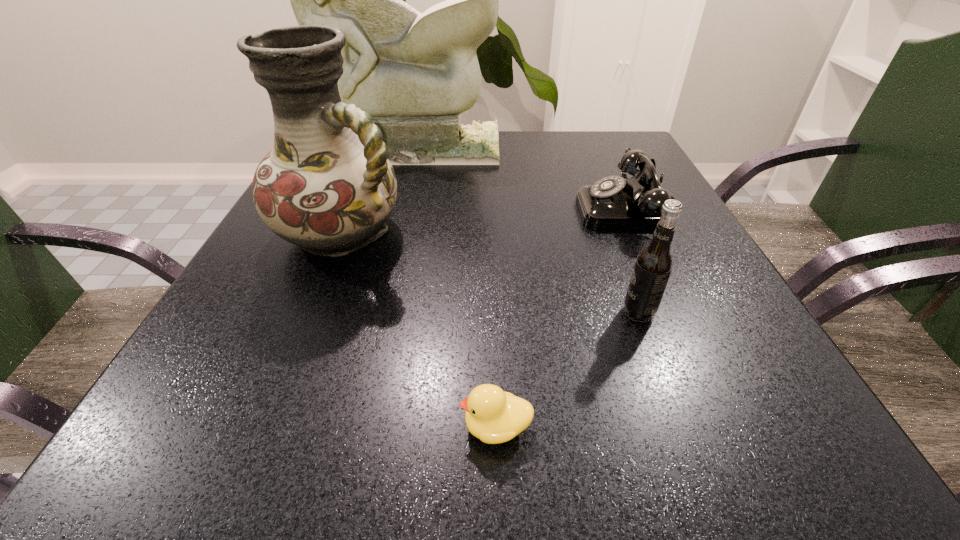
The height and width of the screenshot is (540, 960). In order to click on free space located on the label of the root beer in this screenshot , I will do `click(440, 312)`.

You are a GUI agent. You are given a task and a screenshot of the screen. Output one action in this format:
    pyautogui.click(x=<x>, y=<y>)
    Task: Click on the vacant space situated on the label of the root beer
    The width and height of the screenshot is (960, 540).
    Given the screenshot: What is the action you would take?
    pyautogui.click(x=484, y=312)

Where is `vacant area located on the dial of the second shortest object`? vacant area located on the dial of the second shortest object is located at coordinates (397, 210).

Locate an element on the screen. This screenshot has width=960, height=540. vacant space located on the dial of the second shortest object is located at coordinates (407, 210).

You are a GUI agent. You are given a task and a screenshot of the screen. Output one action in this format:
    pyautogui.click(x=<x>, y=<y>)
    Task: Click on the vacant space located on the dial of the second shortest object
    This screenshot has height=540, width=960.
    Given the screenshot: What is the action you would take?
    [x=502, y=210]

Find the location of a particular element. This screenshot has height=540, width=960. free space located on the beak of the nearest object is located at coordinates (284, 427).

In order to click on free space located on the beak of the nearest object in this screenshot , I will do `click(188, 427)`.

Where is `vacant area situated on the beak of the nearest object`? The width and height of the screenshot is (960, 540). vacant area situated on the beak of the nearest object is located at coordinates (212, 427).

You are a GUI agent. You are given a task and a screenshot of the screen. Output one action in this format:
    pyautogui.click(x=<x>, y=<y>)
    Task: Click on the object that is at the far edge
    The image size is (960, 540).
    Given the screenshot: What is the action you would take?
    pyautogui.click(x=414, y=73)

At what (x,y) coordinates should I click in order to perform the action: click on object located at the near edge. Please return your answer as a coordinate pair (x, y). Looking at the image, I should click on (493, 416).